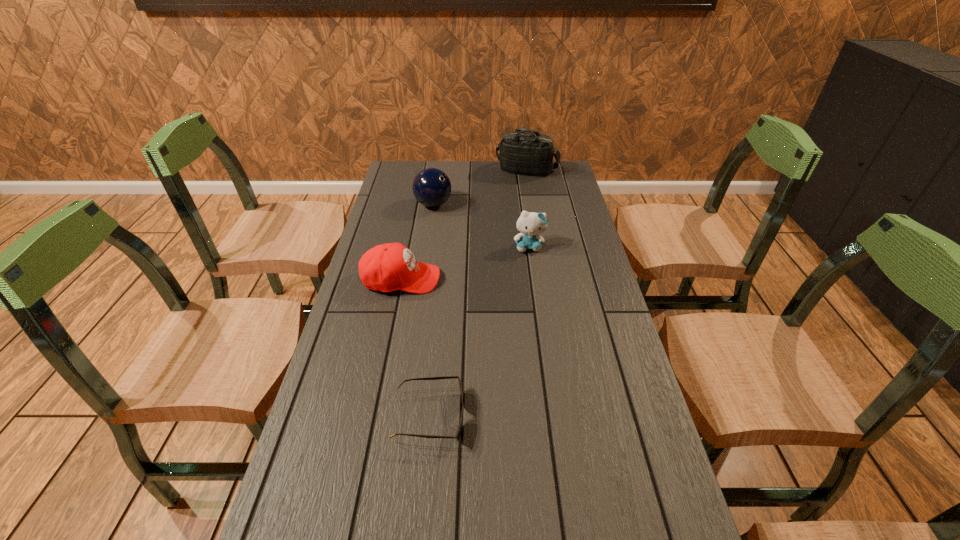
Where is `shoulder bag`? shoulder bag is located at coordinates (522, 153).

Locate an element on the screen. Image resolution: width=960 pixels, height=540 pixels. the tallest object is located at coordinates (522, 153).

Where is `bowling ball`? bowling ball is located at coordinates (431, 187).

Locate an element on the screen. The height and width of the screenshot is (540, 960). kitten is located at coordinates (531, 224).

I want to click on baseball cap, so click(388, 267).

Find the location of a particular element. This screenshot has height=540, width=960. the second shortest object is located at coordinates (388, 267).

I want to click on the nearest object, so click(x=458, y=435).

Find the location of a particular element. The height and width of the screenshot is (540, 960). sunglasses is located at coordinates (458, 435).

Find the location of `vacant space positioned at the front padded panel of the shoulder bag`. vacant space positioned at the front padded panel of the shoulder bag is located at coordinates (532, 200).

The width and height of the screenshot is (960, 540). What are the coordinates of `free space located 0.220m on the surface of the bowling ball near the finger holes` in the screenshot? It's located at (511, 205).